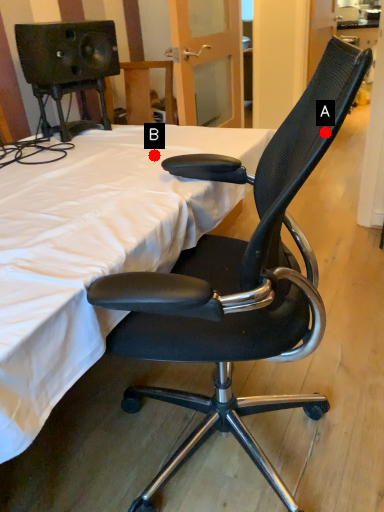
Question: Two points are circled on the image, labeled by A and B beside each circle. Which point appears closest to the camera in this image?

Choices:
 (A) A is closer
 (B) B is closer

Answer: (A)